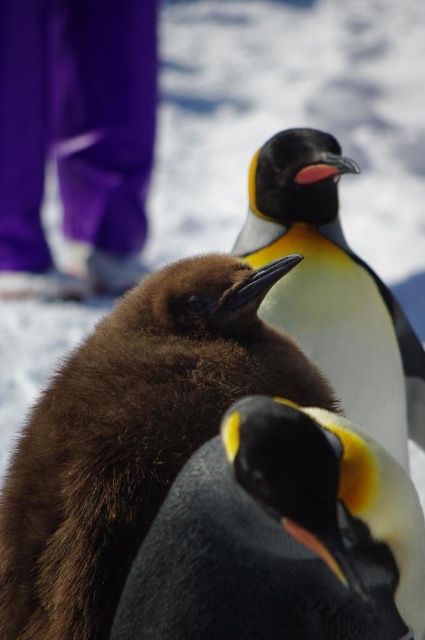
Question: Which point appears farthest from the camera in this image?

Choices:
 (A) (312, 451)
 (B) (323, 195)
 (C) (73, 410)

Answer: (B)

Question: Which point is closer to the camera?

Choices:
 (A) (410, 561)
 (B) (135, 433)

Answer: (A)

Question: Does brown fuzzy penguin at center have a greater width compared to black matte penguin at center?

Choices:
 (A) yes
 (B) no

Answer: (A)

Question: Which of the following is the closest to the observer?

Choices:
 (A) black matte penguin at center
 (B) brown fuzzy penguin at center
 (C) black and white feathers at center

Answer: (A)

Question: Is brown fuzzy penguin at center bigger than black matte penguin at center?

Choices:
 (A) no
 (B) yes

Answer: (B)

Question: Does brown fuzzy penguin at center lie in front of black and white feathers at center?

Choices:
 (A) no
 (B) yes

Answer: (B)